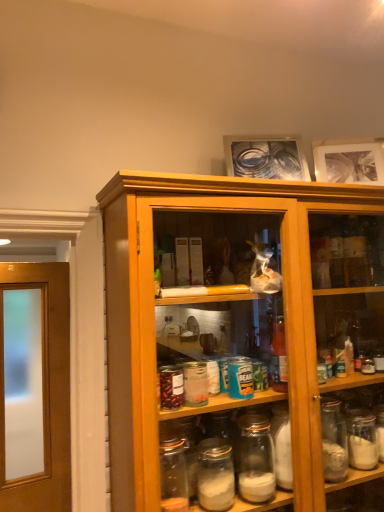
Question: From a real-world perspective, is metallic silver picture frame at upper center, placed as the 1th picture frame when sorted from left to right, physically below matte black picture frame at upper right, arranged as the 2th picture frame when viewed from the left?

Choices:
 (A) no
 (B) yes

Answer: (A)

Question: Considering the relative sizes of metallic silver picture frame at upper center, placed as the 1th picture frame when sorted from left to right, and matte black picture frame at upper right, the 1th picture frame from the right, in the image provided, is metallic silver picture frame at upper center, placed as the 1th picture frame when sorted from left to right, smaller than matte black picture frame at upper right, the 1th picture frame from the right,?

Choices:
 (A) yes
 (B) no

Answer: (B)

Question: From the image's perspective, is metallic silver picture frame at upper center, which is the 2th picture frame in right-to-left order, under matte black picture frame at upper right, the 1th picture frame from the right?

Choices:
 (A) yes
 (B) no

Answer: (B)

Question: From the image's perspective, is metallic silver picture frame at upper center, which is the 2th picture frame in right-to-left order, over matte black picture frame at upper right, the 1th picture frame from the right?

Choices:
 (A) yes
 (B) no

Answer: (A)

Question: Does metallic silver picture frame at upper center, which is the 2th picture frame in right-to-left order, have a greater width compared to matte black picture frame at upper right, the 1th picture frame from the right?

Choices:
 (A) no
 (B) yes

Answer: (B)

Question: Can you confirm if metallic silver picture frame at upper center, which is the 2th picture frame in right-to-left order, is thinner than matte black picture frame at upper right, arranged as the 2th picture frame when viewed from the left?

Choices:
 (A) no
 (B) yes

Answer: (A)

Question: Considering the relative sizes of matte black picture frame at upper right, the 1th picture frame from the right, and metallic silver picture frame at upper center, placed as the 1th picture frame when sorted from left to right, in the image provided, is matte black picture frame at upper right, the 1th picture frame from the right, taller than metallic silver picture frame at upper center, placed as the 1th picture frame when sorted from left to right,?

Choices:
 (A) no
 (B) yes

Answer: (B)

Question: Does matte black picture frame at upper right, the 1th picture frame from the right, have a smaller size compared to metallic silver picture frame at upper center, placed as the 1th picture frame when sorted from left to right?

Choices:
 (A) no
 (B) yes

Answer: (B)

Question: Does matte black picture frame at upper right, the 1th picture frame from the right, lie behind metallic silver picture frame at upper center, placed as the 1th picture frame when sorted from left to right?

Choices:
 (A) no
 (B) yes

Answer: (B)

Question: Considering the relative positions of matte black picture frame at upper right, the 1th picture frame from the right, and metallic silver picture frame at upper center, placed as the 1th picture frame when sorted from left to right, in the image provided, is matte black picture frame at upper right, the 1th picture frame from the right, to the right of metallic silver picture frame at upper center, placed as the 1th picture frame when sorted from left to right, from the viewer's perspective?

Choices:
 (A) yes
 (B) no

Answer: (A)

Question: Would you say metallic silver picture frame at upper center, placed as the 1th picture frame when sorted from left to right, is part of matte black picture frame at upper right, the 1th picture frame from the right,'s contents?

Choices:
 (A) no
 (B) yes

Answer: (A)

Question: Does matte black picture frame at upper right, arranged as the 2th picture frame when viewed from the left, have a greater width compared to metallic silver picture frame at upper center, which is the 2th picture frame in right-to-left order?

Choices:
 (A) no
 (B) yes

Answer: (A)

Question: Considering the positions of matte black picture frame at upper right, arranged as the 2th picture frame when viewed from the left, and metallic silver picture frame at upper center, which is the 2th picture frame in right-to-left order, in the image, is matte black picture frame at upper right, arranged as the 2th picture frame when viewed from the left, bigger or smaller than metallic silver picture frame at upper center, which is the 2th picture frame in right-to-left order,?

Choices:
 (A) big
 (B) small

Answer: (B)